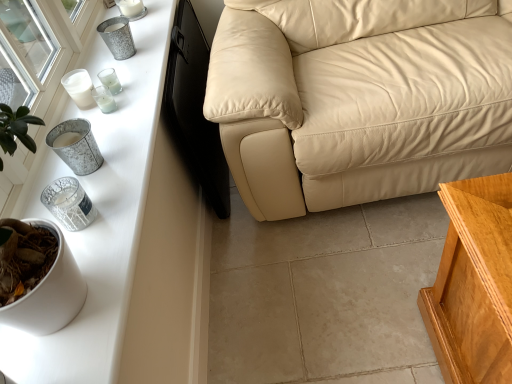
In order to click on blank space situated above white glossy table at left (from a real-world perspective) in this screenshot , I will do `click(105, 129)`.